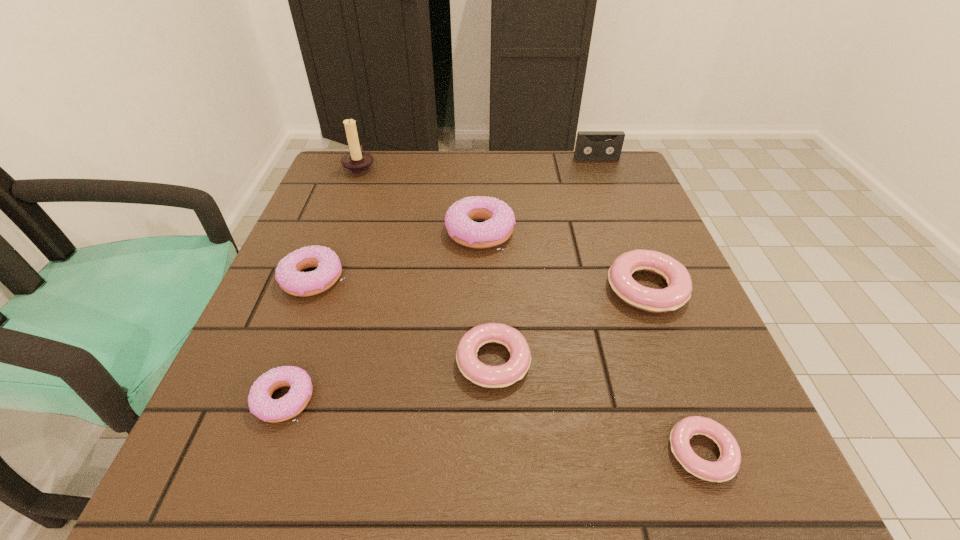
Where is `vacant area that lies between the second nearest purple doughnut and the biggest pink doughnut`? vacant area that lies between the second nearest purple doughnut and the biggest pink doughnut is located at coordinates (480, 284).

What are the coordinates of `object that is the sixth closest one to the smallest pink doughnut` in the screenshot? It's located at (590, 145).

Locate an element on the screen. object that is the fifth closest to the second tallest object is located at coordinates (289, 275).

Identify which doughnut is the fourth closest to the biggest pink doughnut. Please provide its 2D coordinates. Your answer should be formatted as a tuple, i.e. [(x, y)], where the tuple contains the x and y coordinates of a point satisfying the conditions above.

[(289, 275)]

Find the location of a particular element. doughnut that is the third nearest to the second farthest pink doughnut is located at coordinates (459, 220).

The image size is (960, 540). Find the location of `purple doughnut that stands as the second closest to the second nearest purple doughnut`. purple doughnut that stands as the second closest to the second nearest purple doughnut is located at coordinates (459, 220).

Locate which purple doughnut ranks third in proximity to the leftmost pink doughnut. Please provide its 2D coordinates. Your answer should be formatted as a tuple, i.e. [(x, y)], where the tuple contains the x and y coordinates of a point satisfying the conditions above.

[(289, 275)]

Identify which pink doughnut is the second nearest to the biggest pink doughnut. Please provide its 2D coordinates. Your answer should be formatted as a tuple, i.e. [(x, y)], where the tuple contains the x and y coordinates of a point satisfying the conditions above.

[(725, 468)]

Locate an element on the screen. pink doughnut object that ranks as the second closest to the videotape is located at coordinates (486, 376).

Locate an element on the screen. free space that satisfies the following two spatial constraints: 1. on the back side of the rightmost purple doughnut; 2. on the right side of the smallest purple doughnut is located at coordinates (345, 231).